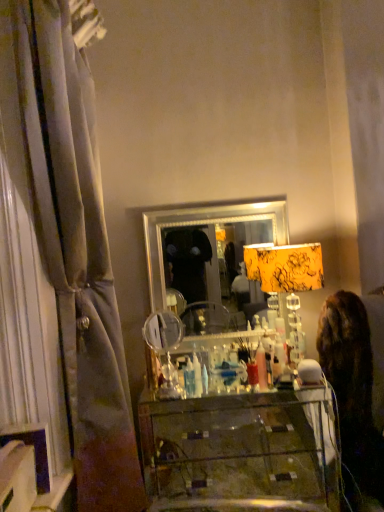
In order to face yellow floral fabric lampshade at center, should I rotate leftwards or rightwards?

Turn right approximately 13.309 degrees to face it.

In order to click on dark brown fur at right in this screenshot , I will do `click(356, 382)`.

The width and height of the screenshot is (384, 512). I want to click on yellow floral fabric lampshade at center, so click(x=285, y=267).

Is yellow floral fabric lampshade at center aimed at silky gray curtain at left?

No, yellow floral fabric lampshade at center is not oriented towards silky gray curtain at left.

Looking at this image, can you confirm if yellow floral fabric lampshade at center is smaller than silky gray curtain at left?

Correct, yellow floral fabric lampshade at center occupies less space than silky gray curtain at left.

From the image's perspective, which object appears higher, yellow floral fabric lampshade at center or silky gray curtain at left?

silky gray curtain at left, from the image's perspective.

Does point (293, 260) appear closer or farther from the camera than point (3, 161)?

Clearly, point (293, 260) is more distant from the camera than point (3, 161).

Is silver/metallic mirror at center shorter than transparent glass vanity at center?

No, silver/metallic mirror at center is not shorter than transparent glass vanity at center.

Is silver/metallic mirror at center outside of transparent glass vanity at center?

silver/metallic mirror at center is positioned outside transparent glass vanity at center.

Can you confirm if silver/metallic mirror at center is positioned to the left of transparent glass vanity at center?

Yes, silver/metallic mirror at center is to the left of transparent glass vanity at center.

Which is behind, point (218, 212) or point (294, 406)?

The point (294, 406) is more distant.

In terms of width, does dark brown fur at right look wider or thinner when compared to yellow floral fabric lampshade at center?

dark brown fur at right is wider than yellow floral fabric lampshade at center.

Where is `woman that appears on the right of yellow floral fabric lampshade at center`? The width and height of the screenshot is (384, 512). woman that appears on the right of yellow floral fabric lampshade at center is located at coordinates (356, 382).

Is dark brown fur at right positioned before yellow floral fabric lampshade at center?

Yes, dark brown fur at right is in front of yellow floral fabric lampshade at center.

Looking at this image, how different are the orientations of silver/metallic mirror at center and yellow floral fabric lampshade at center in degrees?

silver/metallic mirror at center and yellow floral fabric lampshade at center are facing 0.935 degrees away from each other.

From the image's perspective, is silver/metallic mirror at center located above yellow floral fabric lampshade at center?

Yes, from the image's perspective, silver/metallic mirror at center is over yellow floral fabric lampshade at center.

Is silver/metallic mirror at center further to the viewer compared to yellow floral fabric lampshade at center?

Yes, the depth of silver/metallic mirror at center is greater than that of yellow floral fabric lampshade at center.

Which of these two, silver/metallic mirror at center or yellow floral fabric lampshade at center, is smaller?

silver/metallic mirror at center.

Based on the photo, are transparent glass vanity at center and dark brown fur at right making contact?

transparent glass vanity at center is not next to dark brown fur at right, and they're not touching.

Which of these two, transparent glass vanity at center or dark brown fur at right, stands taller?

With more height is dark brown fur at right.

Can you confirm if transparent glass vanity at center is smaller than dark brown fur at right?

No.

Considering the relative sizes of transparent glass vanity at center and dark brown fur at right in the image provided, is transparent glass vanity at center wider than dark brown fur at right?

Indeed, transparent glass vanity at center has a greater width compared to dark brown fur at right.

Which of these two, transparent glass vanity at center or yellow floral fabric lampshade at center, is wider?

transparent glass vanity at center is wider.

Is transparent glass vanity at center inside or outside of yellow floral fabric lampshade at center?

transparent glass vanity at center is not enclosed by yellow floral fabric lampshade at center.

From a real-world perspective, which is physically below, transparent glass vanity at center or yellow floral fabric lampshade at center?

transparent glass vanity at center.

From the image's perspective, is dark brown fur at right beneath silky gray curtain at left?

Yes, from the image's perspective, dark brown fur at right is below silky gray curtain at left.

Who is bigger, dark brown fur at right or silky gray curtain at left?

Bigger between the two is silky gray curtain at left.

Is dark brown fur at right oriented towards silky gray curtain at left?

No.

Is dark brown fur at right not near silky gray curtain at left?

Yes, dark brown fur at right and silky gray curtain at left are located far from each other.

The image size is (384, 512). Find the location of `table lamp on the right side of silky gray curtain at left`. table lamp on the right side of silky gray curtain at left is located at coordinates (285, 267).

This screenshot has height=512, width=384. Find the location of `mirror above the transparent glass vanity at center (from the image's perspective)`. mirror above the transparent glass vanity at center (from the image's perspective) is located at coordinates (209, 226).

Considering their positions, is silky gray curtain at left positioned further to transparent glass vanity at center than dark brown fur at right?

Among the two, silky gray curtain at left is located further to transparent glass vanity at center.

Looking at this image, from the image, which object appears to be nearer to silver/metallic mirror at center, dark brown fur at right or transparent glass vanity at center?

dark brown fur at right is closer to silver/metallic mirror at center.

From the image, which object appears to be nearer to silver/metallic mirror at center, yellow floral fabric lampshade at center or silky gray curtain at left?

The object closer to silver/metallic mirror at center is yellow floral fabric lampshade at center.

Considering their positions, is silky gray curtain at left positioned further to transparent glass vanity at center than silver/metallic mirror at center?

Based on the image, silver/metallic mirror at center appears to be further to transparent glass vanity at center.

Estimate the real-world distances between objects in this image. Which object is closer to silky gray curtain at left, transparent glass vanity at center or dark brown fur at right?

transparent glass vanity at center.

Looking at the image, which one is located further to silver/metallic mirror at center, dark brown fur at right or silky gray curtain at left?

Among the two, silky gray curtain at left is located further to silver/metallic mirror at center.

Considering their positions, is silky gray curtain at left positioned closer to silver/metallic mirror at center than dark brown fur at right?

Result: The object closer to silver/metallic mirror at center is dark brown fur at right.

When comparing their distances from yellow floral fabric lampshade at center, does silver/metallic mirror at center or dark brown fur at right seem closer?

Among the two, silver/metallic mirror at center is located nearer to yellow floral fabric lampshade at center.

Where is `table lamp that lies between silver/metallic mirror at center and transparent glass vanity at center from top to bottom`? table lamp that lies between silver/metallic mirror at center and transparent glass vanity at center from top to bottom is located at coordinates (285, 267).

Where is `furniture between silky gray curtain at left and dark brown fur at right from left to right`? This screenshot has height=512, width=384. furniture between silky gray curtain at left and dark brown fur at right from left to right is located at coordinates (241, 452).

Locate an element on the screen. This screenshot has height=512, width=384. table lamp located between silky gray curtain at left and dark brown fur at right in the left-right direction is located at coordinates (285, 267).

The width and height of the screenshot is (384, 512). I want to click on woman positioned between silky gray curtain at left and silver/metallic mirror at center from near to far, so click(x=356, y=382).